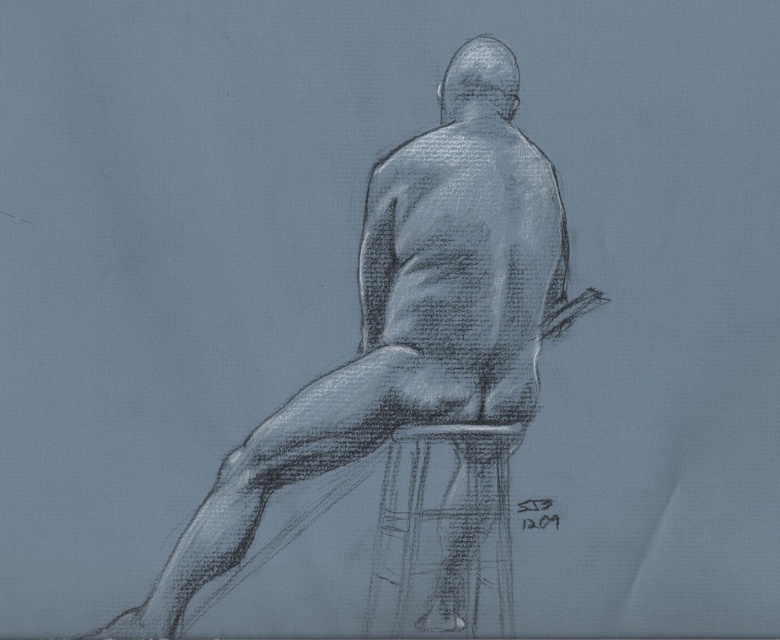
Who is shorter, charcoal figure at center or charcoal textured stool at center?

charcoal textured stool at center is shorter.

In order to click on charcoal figure at center in this screenshot , I will do `click(410, 346)`.

Identify the location of charcoal figure at center. The height and width of the screenshot is (640, 780). (410, 346).

You are a GUI agent. You are given a task and a screenshot of the screen. Output one action in this format:
    pyautogui.click(x=<x>, y=<y>)
    Task: Click on the charcoal figure at center
    
    Given the screenshot: What is the action you would take?
    pyautogui.click(x=410, y=346)